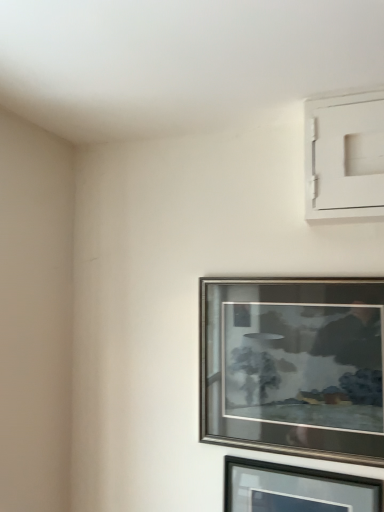
At what (x,y) coordinates should I click in order to perform the action: click on black glass picture frame at lower right, the 1th picture frame from the bottom. Please return your answer as a coordinate pair (x, y). The height and width of the screenshot is (512, 384). Looking at the image, I should click on 295,489.

What do you see at coordinates (295, 489) in the screenshot? I see `black glass picture frame at lower right, the 1th picture frame from the bottom` at bounding box center [295, 489].

What is the approximate height of black glass picture frame at lower right, the 1th picture frame from the bottom?

It is 37.74 centimeters.

This screenshot has width=384, height=512. Describe the element at coordinates (294, 366) in the screenshot. I see `silver metallic picture frame at center, the 1th picture frame when ordered from top to bottom` at that location.

The width and height of the screenshot is (384, 512). In order to click on silver metallic picture frame at center, positioned as the second picture frame in bottom-to-top order in this screenshot , I will do `click(294, 366)`.

Find the location of a particular element. This screenshot has width=384, height=512. black glass picture frame at lower right, the second picture frame from the top is located at coordinates (295, 489).

Which is more to the left, silver metallic picture frame at center, positioned as the second picture frame in bottom-to-top order, or black glass picture frame at lower right, the second picture frame from the top?

silver metallic picture frame at center, positioned as the second picture frame in bottom-to-top order, is more to the left.

Who is more distant, silver metallic picture frame at center, the 1th picture frame when ordered from top to bottom, or black glass picture frame at lower right, the 1th picture frame from the bottom?

silver metallic picture frame at center, the 1th picture frame when ordered from top to bottom, is more distant.

Which is farther from the camera, (213, 324) or (239, 492)?

Point (213, 324)

From the image's perspective, is silver metallic picture frame at center, positioned as the second picture frame in bottom-to-top order, beneath black glass picture frame at lower right, the second picture frame from the top?

No, from the image's perspective, silver metallic picture frame at center, positioned as the second picture frame in bottom-to-top order, is not below black glass picture frame at lower right, the second picture frame from the top.

From a real-world perspective, which object stands above the other?

In real-world perspective, silver metallic picture frame at center, positioned as the second picture frame in bottom-to-top order, is above.

Considering the sizes of objects silver metallic picture frame at center, the 1th picture frame when ordered from top to bottom, and black glass picture frame at lower right, the second picture frame from the top, in the image provided, who is thinner, silver metallic picture frame at center, the 1th picture frame when ordered from top to bottom, or black glass picture frame at lower right, the second picture frame from the top,?

Thinner between the two is black glass picture frame at lower right, the second picture frame from the top.

Can you confirm if silver metallic picture frame at center, positioned as the second picture frame in bottom-to-top order, is shorter than black glass picture frame at lower right, the 1th picture frame from the bottom?

Incorrect, the height of silver metallic picture frame at center, positioned as the second picture frame in bottom-to-top order, does not fall short of that of black glass picture frame at lower right, the 1th picture frame from the bottom.

Looking at the image, does silver metallic picture frame at center, positioned as the second picture frame in bottom-to-top order, seem bigger or smaller compared to black glass picture frame at lower right, the 1th picture frame from the bottom?

Considering their sizes, silver metallic picture frame at center, positioned as the second picture frame in bottom-to-top order, takes up more space than black glass picture frame at lower right, the 1th picture frame from the bottom.

Choose the correct answer: Is silver metallic picture frame at center, positioned as the second picture frame in bottom-to-top order, inside black glass picture frame at lower right, the second picture frame from the top, or outside it?

silver metallic picture frame at center, positioned as the second picture frame in bottom-to-top order, is not enclosed by black glass picture frame at lower right, the second picture frame from the top.

Is silver metallic picture frame at center, positioned as the second picture frame in bottom-to-top order, far from black glass picture frame at lower right, the 1th picture frame from the bottom?

No, silver metallic picture frame at center, positioned as the second picture frame in bottom-to-top order, is not far from black glass picture frame at lower right, the 1th picture frame from the bottom.

Could you tell me if silver metallic picture frame at center, the 1th picture frame when ordered from top to bottom, is turned towards black glass picture frame at lower right, the 1th picture frame from the bottom?

No, silver metallic picture frame at center, the 1th picture frame when ordered from top to bottom, is not turned towards black glass picture frame at lower right, the 1th picture frame from the bottom.

How different are the orientations of silver metallic picture frame at center, the 1th picture frame when ordered from top to bottom, and black glass picture frame at lower right, the 1th picture frame from the bottom, in degrees?

silver metallic picture frame at center, the 1th picture frame when ordered from top to bottom, and black glass picture frame at lower right, the 1th picture frame from the bottom, are facing 0.00365 degrees away from each other.

How far apart are silver metallic picture frame at center, positioned as the second picture frame in bottom-to-top order, and black glass picture frame at lower right, the 1th picture frame from the bottom?

silver metallic picture frame at center, positioned as the second picture frame in bottom-to-top order, and black glass picture frame at lower right, the 1th picture frame from the bottom, are 8.20 inches apart.

What are the coordinates of `picture frame lying on the right of silver metallic picture frame at center, positioned as the second picture frame in bottom-to-top order` in the screenshot? It's located at (295, 489).

Which is more to the left, black glass picture frame at lower right, the 1th picture frame from the bottom, or silver metallic picture frame at center, the 1th picture frame when ordered from top to bottom?

silver metallic picture frame at center, the 1th picture frame when ordered from top to bottom, is more to the left.

Does black glass picture frame at lower right, the second picture frame from the top, lie behind silver metallic picture frame at center, positioned as the second picture frame in bottom-to-top order?

No, it is not.

Is point (355, 479) less distant than point (277, 328)?

Yes, point (355, 479) is in front of point (277, 328).

From the image's perspective, is black glass picture frame at lower right, the 1th picture frame from the bottom, above or below silver metallic picture frame at center, positioned as the second picture frame in bottom-to-top order?

black glass picture frame at lower right, the 1th picture frame from the bottom, is situated lower than silver metallic picture frame at center, positioned as the second picture frame in bottom-to-top order, in the image.

From a real-world perspective, which is physically above, black glass picture frame at lower right, the 1th picture frame from the bottom, or silver metallic picture frame at center, positioned as the second picture frame in bottom-to-top order?

From a 3D spatial view, silver metallic picture frame at center, positioned as the second picture frame in bottom-to-top order, is above.

Between black glass picture frame at lower right, the 1th picture frame from the bottom, and silver metallic picture frame at center, positioned as the second picture frame in bottom-to-top order, which one has larger width?

silver metallic picture frame at center, positioned as the second picture frame in bottom-to-top order.

Who is taller, black glass picture frame at lower right, the 1th picture frame from the bottom, or silver metallic picture frame at center, positioned as the second picture frame in bottom-to-top order?

With more height is silver metallic picture frame at center, positioned as the second picture frame in bottom-to-top order.

Which of these two, black glass picture frame at lower right, the second picture frame from the top, or silver metallic picture frame at center, the 1th picture frame when ordered from top to bottom, is smaller?

Smaller between the two is black glass picture frame at lower right, the second picture frame from the top.

From the picture: Would you say black glass picture frame at lower right, the second picture frame from the top, contains silver metallic picture frame at center, positioned as the second picture frame in bottom-to-top order?

No.

Is black glass picture frame at lower right, the second picture frame from the top, positioned far away from silver metallic picture frame at center, positioned as the second picture frame in bottom-to-top order?

They are positioned close to each other.

Is silver metallic picture frame at center, the 1th picture frame when ordered from top to bottom, at the back of black glass picture frame at lower right, the 1th picture frame from the bottom?

No.

Measure the distance from black glass picture frame at lower right, the second picture frame from the top, to silver metallic picture frame at center, positioned as the second picture frame in bottom-to-top order.

The distance of black glass picture frame at lower right, the second picture frame from the top, from silver metallic picture frame at center, positioned as the second picture frame in bottom-to-top order, is 8.20 inches.

This screenshot has height=512, width=384. I want to click on picture frame below the silver metallic picture frame at center, positioned as the second picture frame in bottom-to-top order (from the image's perspective), so click(x=295, y=489).

Find the location of `picture frame below the silver metallic picture frame at center, the 1th picture frame when ordered from top to bottom (from a real-world perspective)`. picture frame below the silver metallic picture frame at center, the 1th picture frame when ordered from top to bottom (from a real-world perspective) is located at coordinates (295, 489).

Find the location of a particular element. This screenshot has height=512, width=384. picture frame located on the left of black glass picture frame at lower right, the second picture frame from the top is located at coordinates (294, 366).